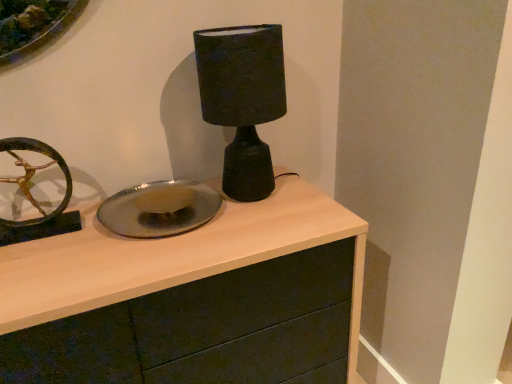
You are a GUI agent. You are given a task and a screenshot of the screen. Output one action in this format:
    pyautogui.click(x=<x>, y=<y>)
    Task: Click on the free space that is in between matte black lamp at center and shiny metallic plate at center
    
    Given the screenshot: What is the action you would take?
    pyautogui.click(x=245, y=213)